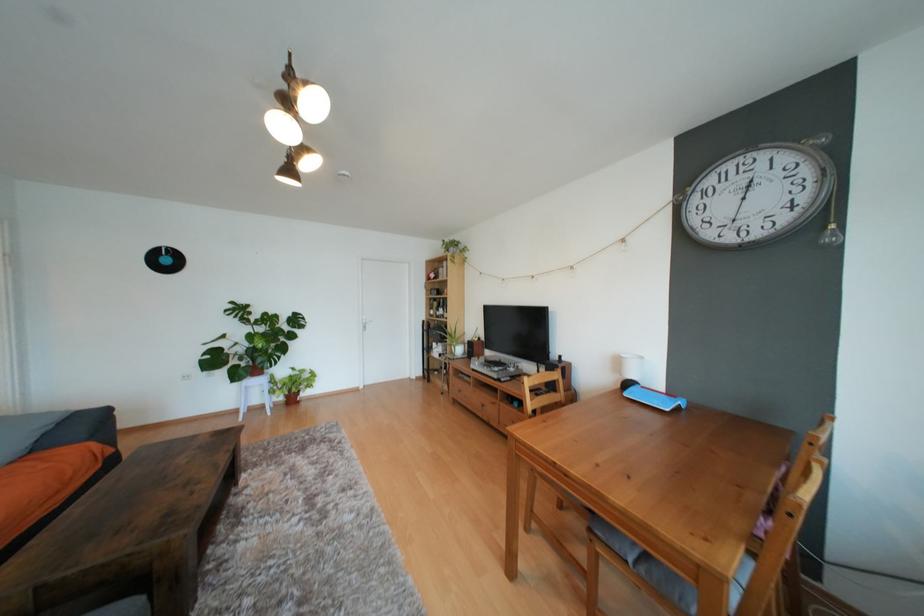
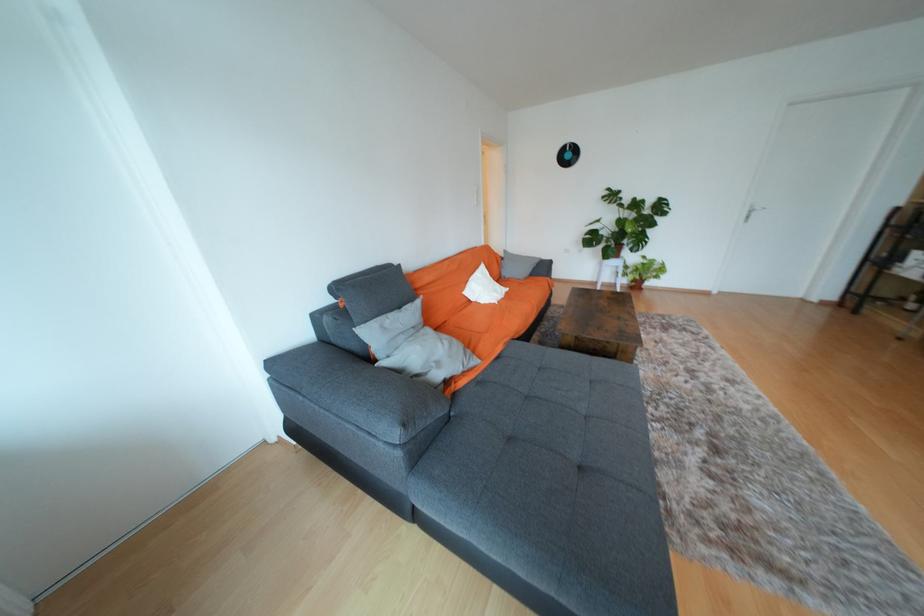
Find the pixel in the second image that matches (298,400) in the first image.

(641, 286)